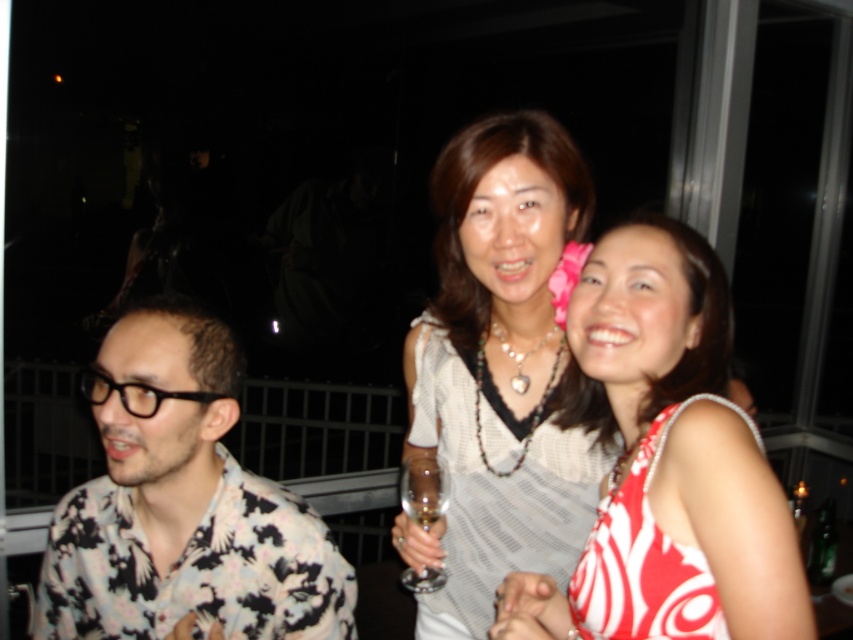
Question: Which point appears closest to the camera in this image?

Choices:
 (A) (508, 413)
 (B) (422, 582)
 (C) (625, 531)

Answer: (C)

Question: Can you confirm if clear glass wine glass at center is bigger than clear glass wine at center?

Choices:
 (A) yes
 (B) no

Answer: (A)

Question: Based on their relative distances, which object is nearer to the red and white printed dress at center?

Choices:
 (A) white textured dress at center
 (B) red printed fabric dress at lower right
 (C) floral-patterned shirt at left

Answer: (B)

Question: Can you confirm if red printed fabric dress at lower right is bigger than clear glass wine glass at center?

Choices:
 (A) yes
 (B) no

Answer: (A)

Question: Can you confirm if white textured dress at center is wider than red printed fabric dress at lower right?

Choices:
 (A) no
 (B) yes

Answer: (B)

Question: Which object is positioned closest to the floral-patterned shirt at left?

Choices:
 (A) clear glass wine glass at center
 (B) red printed fabric dress at lower right
 (C) red and white printed dress at center
 (D) clear glass wine at center

Answer: (A)